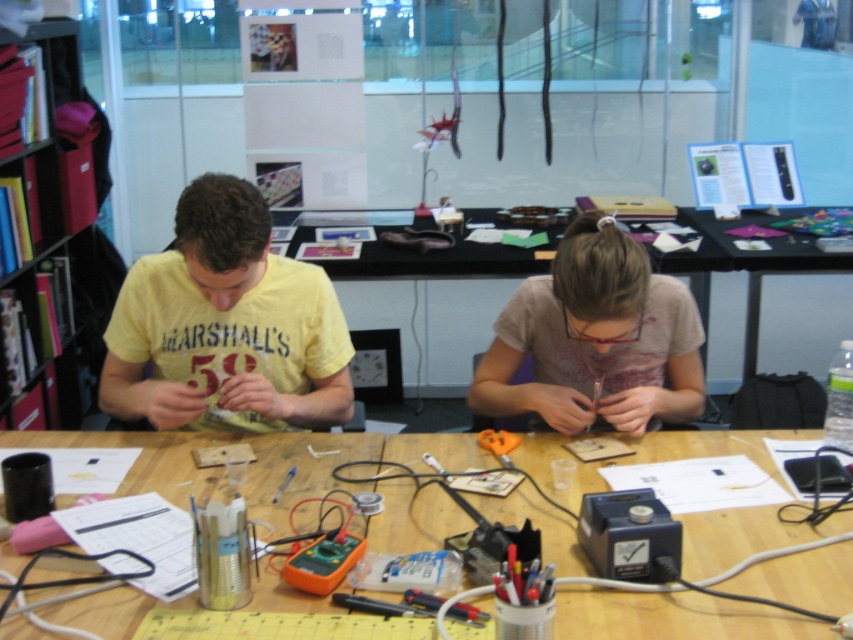
Based on the photo, you are standing at the edge of the wooden table at center. There is a point labeled as point (x=671, y=616). Is this point located on the wooden table at center?

Yes, the point (x=671, y=616) is on the wooden table at center.

You need to place a rectangular object that is 15 cm wide on the table. The red cardboard bookshelf at left and the clear plastic ruler at center are in the way. Which object should you move to make space?

The red cardboard bookshelf at left is wider than the clear plastic ruler at center, so you should move the red cardboard bookshelf at left to make space for the 15 cm wide object.